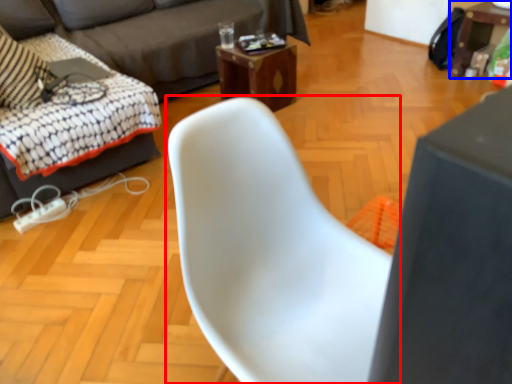
Question: Which point is closer to the camera, chair (highlighted by a red box) or table (highlighted by a blue box)?

Choices:
 (A) chair
 (B) table

Answer: (A)